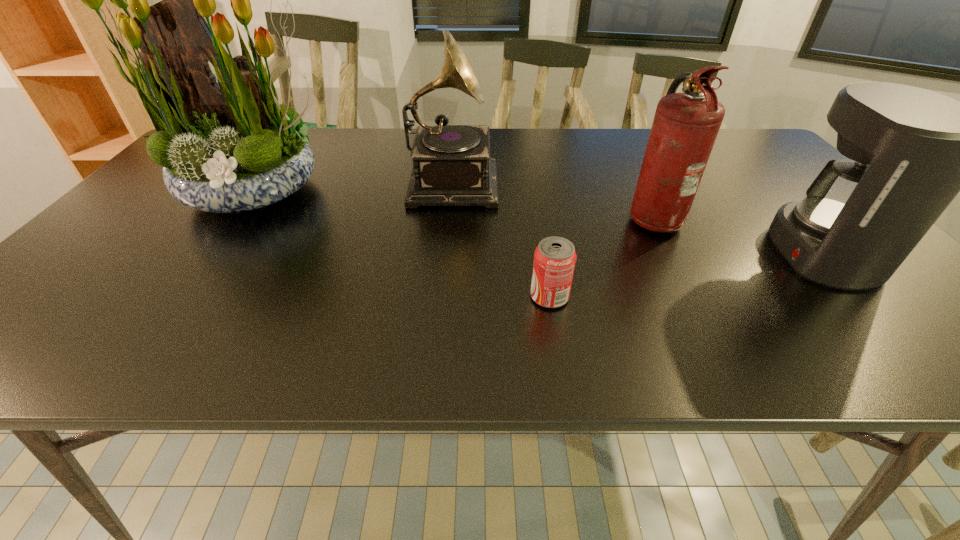
Find the location of a particular element. vacant area situated 0.200m at the front of the fire extinguisher where the nozzle is aimed is located at coordinates click(547, 217).

Image resolution: width=960 pixels, height=540 pixels. What are the coordinates of `vacant space located at the front of the fire extinguisher where the nozzle is aimed` in the screenshot? It's located at (547, 217).

Identify the location of free space located 0.150m on the button side of the coffee maker. This screenshot has width=960, height=540. (710, 253).

This screenshot has height=540, width=960. In order to click on vacant area situated on the button side of the coffee maker in this screenshot , I will do `click(707, 253)`.

Where is `blank space located 0.240m on the button side of the coffee maker`? blank space located 0.240m on the button side of the coffee maker is located at coordinates point(671,253).

The image size is (960, 540). In order to click on vacant space situated 0.120m on the front of the shortest object in this screenshot , I will do `click(560, 360)`.

Identify the location of flower arrangement present at the far edge. (229, 146).

Find the location of a particular element. The height and width of the screenshot is (540, 960). record player that is at the far edge is located at coordinates (452, 166).

You are a GUI agent. You are given a task and a screenshot of the screen. Output one action in this format:
    pyautogui.click(x=<x>, y=<y>)
    Task: Click on the object situated at the left edge
    The width and height of the screenshot is (960, 540).
    Given the screenshot: What is the action you would take?
    pyautogui.click(x=229, y=146)

Where is `object located in the right edge section of the desktop`? object located in the right edge section of the desktop is located at coordinates (911, 151).